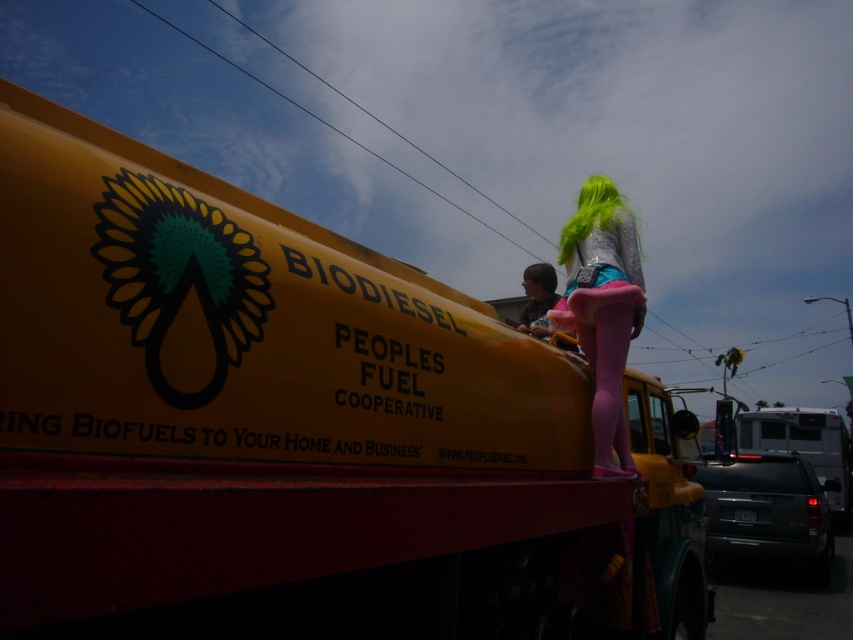
Question: Does neon green hair at upper center have a lesser width compared to green silky hair at upper right?

Choices:
 (A) no
 (B) yes

Answer: (A)

Question: Can you confirm if neon green hair at upper center is smaller than matte brown hair at center?

Choices:
 (A) yes
 (B) no

Answer: (B)

Question: Which point appears closest to the camera in this image?

Choices:
 (A) (560, 234)
 (B) (701, 541)

Answer: (B)

Question: Which point is closer to the camera taking this photo?

Choices:
 (A) (128, 189)
 (B) (560, 324)
 (C) (611, 307)

Answer: (A)

Question: Does matte brown hair at center have a larger size compared to green silky hair at upper right?

Choices:
 (A) no
 (B) yes

Answer: (A)

Question: Among these points, which one is farthest from the camera?

Choices:
 (A) (590, 304)
 (B) (605, 202)
 (C) (531, 273)
 (D) (527, 296)

Answer: (D)